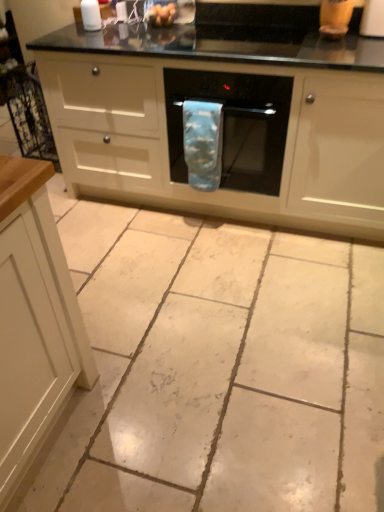
Question: Looking at their shapes, would you say blue fabric oven mitt at center is wider or thinner than white glossy salt shaker at upper left?

Choices:
 (A) wide
 (B) thin

Answer: (A)

Question: In the image, is blue fabric oven mitt at center positioned in front of or behind white glossy salt shaker at upper left?

Choices:
 (A) behind
 (B) front

Answer: (B)

Question: Estimate the real-world distances between objects in this image. Which object is closer to the smooth plastic eggs at upper center?

Choices:
 (A) blue fabric towel at center
 (B) white tile floor at center
 (C) blue fabric oven mitt at center
 (D) white glossy salt shaker at upper left
 (E) black glass oven at center

Answer: (D)

Question: Which is nearer to the blue fabric oven mitt at center?

Choices:
 (A) black glass oven at center
 (B) white tile floor at center
 (C) blue fabric towel at center
 (D) white glossy salt shaker at upper left
 (E) smooth plastic eggs at upper center

Answer: (C)